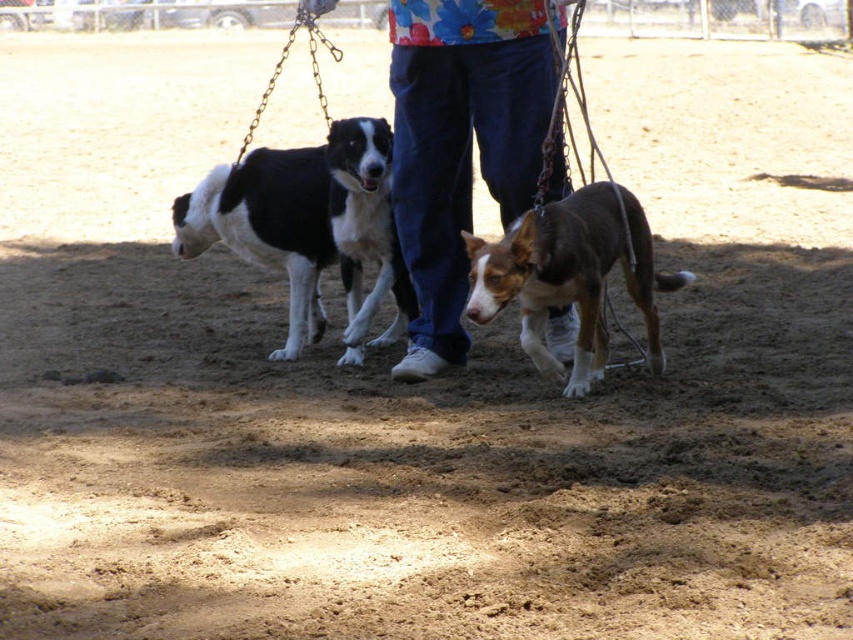
Question: Among these objects, which one is farthest from the camera?

Choices:
 (A) brown/tan fur dog at center
 (B) black and white fur at left

Answer: (B)

Question: Is blue jeans at center above black and white fur at left?

Choices:
 (A) no
 (B) yes

Answer: (B)

Question: Which of the following is the closest to the observer?

Choices:
 (A) coord(604,208)
 (B) coord(430,17)
 (C) coord(248,253)

Answer: (A)

Question: Which point is farther to the camera?

Choices:
 (A) (281, 180)
 (B) (614, 182)
 (C) (456, 33)

Answer: (A)

Question: Does blue jeans at center have a lesser width compared to brown/tan fur dog at center?

Choices:
 (A) yes
 (B) no

Answer: (A)

Question: Does black and white fur at left appear over brown/tan fur dog at center?

Choices:
 (A) yes
 (B) no

Answer: (A)